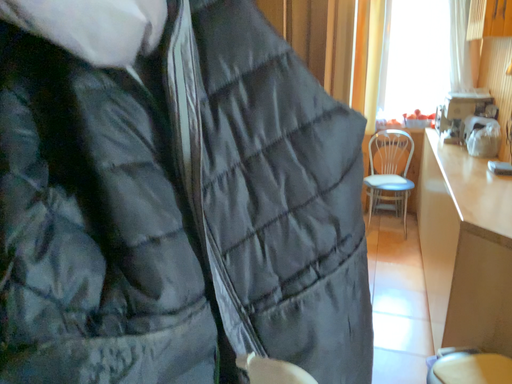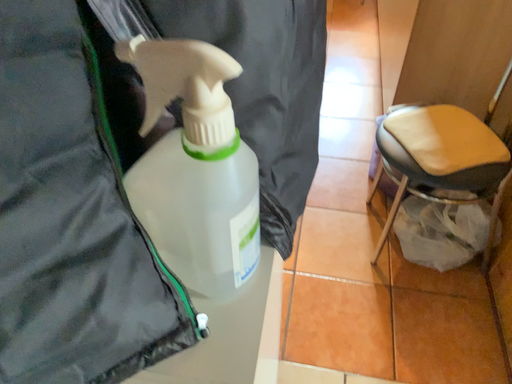
Question: Which way did the camera rotate in the video?

Choices:
 (A) rotated downward
 (B) rotated upward

Answer: (A)